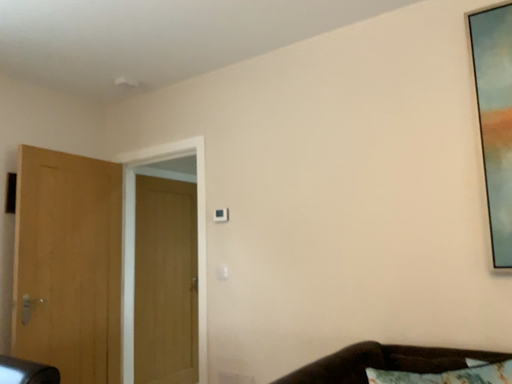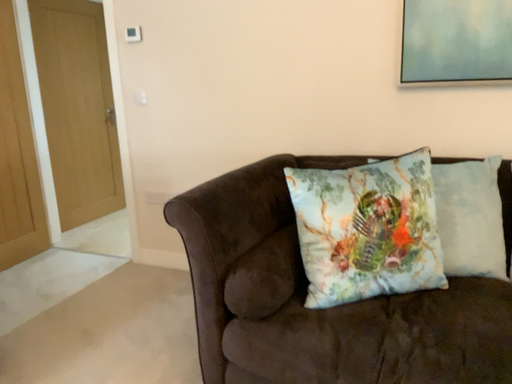
Question: Which way did the camera rotate in the video?

Choices:
 (A) rotated upward
 (B) rotated downward

Answer: (B)